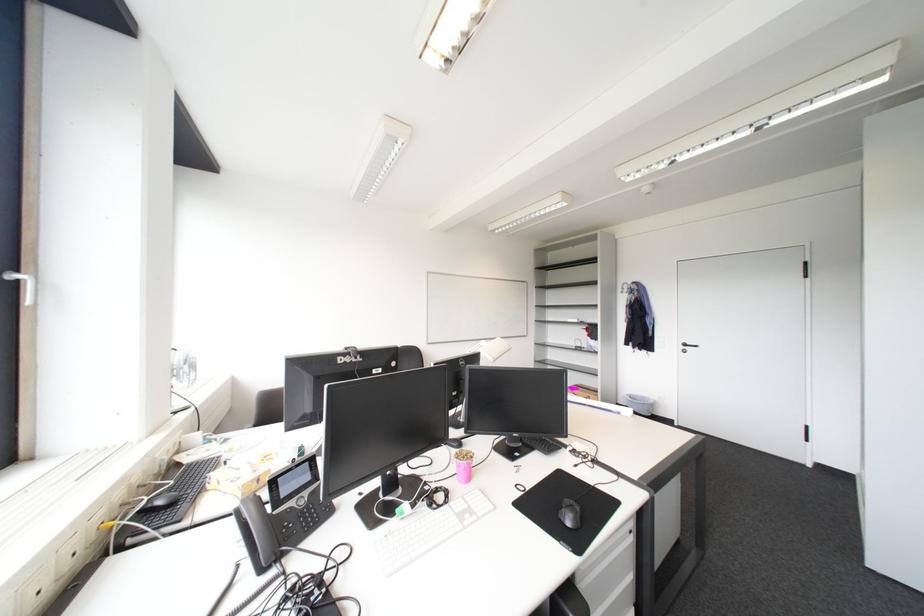
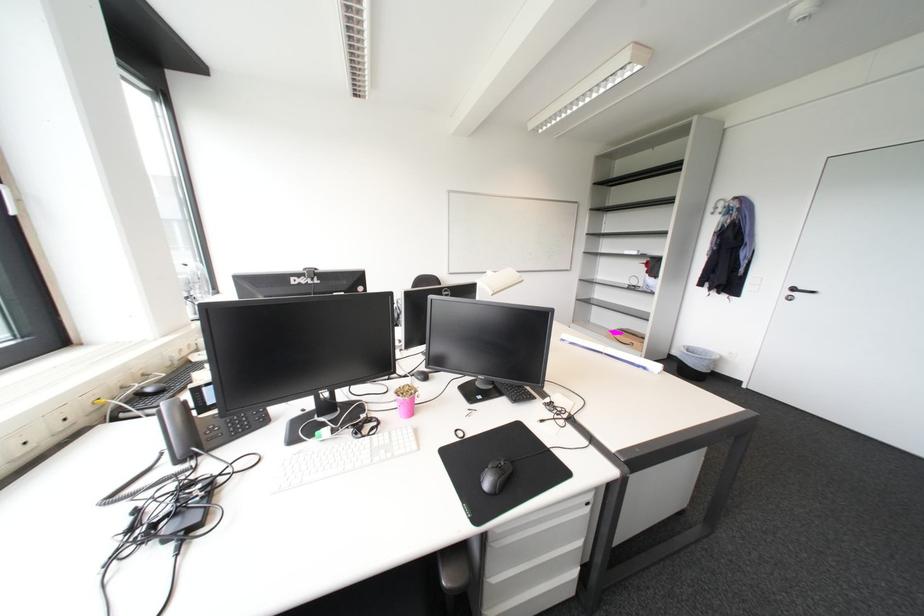
In the second image, find the point that corresponds to [257,567] in the first image.

(176, 456)